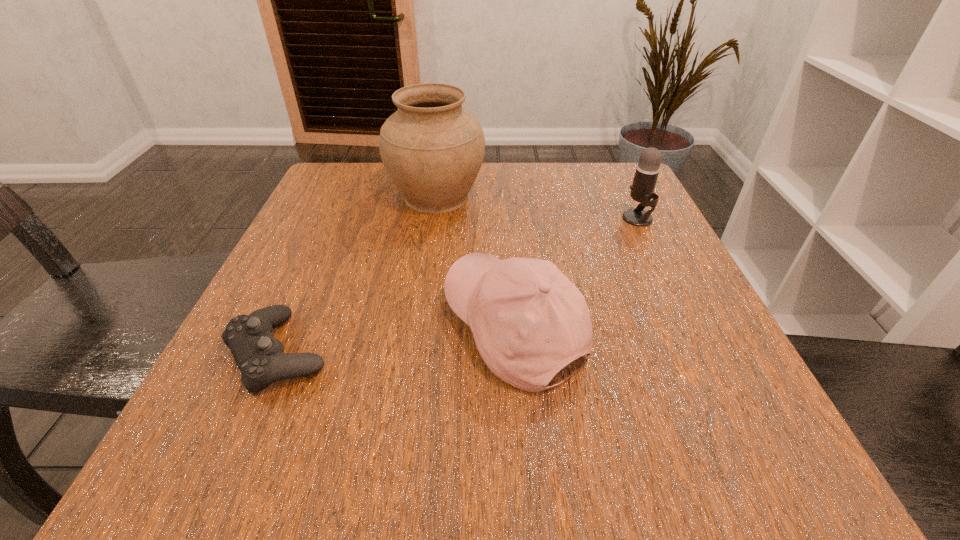
Locate an element on the screen. This screenshot has width=960, height=540. the tallest object is located at coordinates (432, 148).

The image size is (960, 540). What are the coordinates of `microphone` in the screenshot? It's located at (647, 170).

At what (x,y) coordinates should I click in order to perform the action: click on baseball cap. Please return your answer as a coordinate pair (x, y). The width and height of the screenshot is (960, 540). Looking at the image, I should click on (528, 320).

Identify the location of control. (258, 354).

Where is `the leftmost object`? This screenshot has height=540, width=960. the leftmost object is located at coordinates (258, 354).

Image resolution: width=960 pixels, height=540 pixels. I want to click on vacant space located 0.360m on the front of the urn, so click(413, 362).

Locate an element on the screen. vacant space located 0.210m on the left of the microphone is located at coordinates (523, 219).

Locate an element on the screen. This screenshot has height=540, width=960. vacant area situated on the front-facing side of the baseball cap is located at coordinates (348, 329).

Where is `vacant region located 0.300m on the front-facing side of the baseball cap`? This screenshot has width=960, height=540. vacant region located 0.300m on the front-facing side of the baseball cap is located at coordinates (253, 329).

This screenshot has width=960, height=540. I want to click on free spot located on the front-facing side of the baseball cap, so click(317, 329).